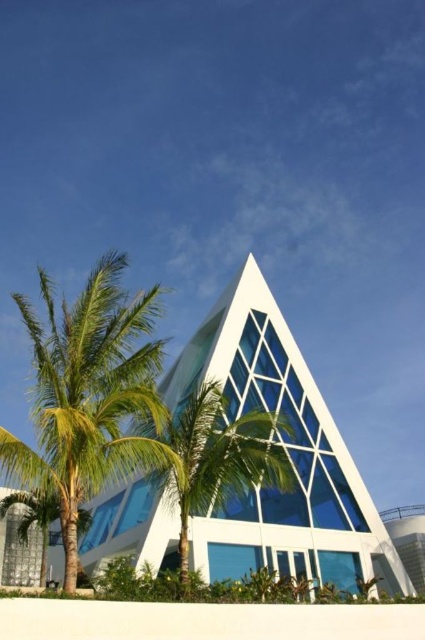
Question: Among these points, which one is nearest to the camera?

Choices:
 (A) (217, 500)
 (B) (104, 275)

Answer: (B)

Question: Is transparent glass chapel at center bigger than green leafy palm tree at center?

Choices:
 (A) no
 (B) yes

Answer: (B)

Question: Which object is the farthest from the green leafy palm tree at left?

Choices:
 (A) green leafy palm tree at center
 (B) transparent glass chapel at center

Answer: (B)

Question: Is transparent glass chapel at center positioned behind green leafy palm tree at left?

Choices:
 (A) yes
 (B) no

Answer: (A)

Question: Does green leafy palm tree at left have a larger size compared to green leafy palm tree at center?

Choices:
 (A) yes
 (B) no

Answer: (A)

Question: Estimate the real-world distances between objects in this image. Which object is farther from the transparent glass chapel at center?

Choices:
 (A) green leafy palm tree at center
 (B) green leafy palm tree at left

Answer: (B)